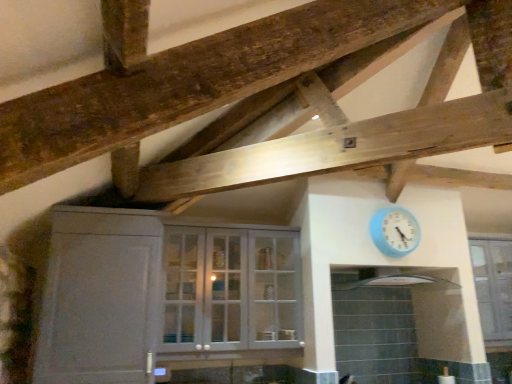
Question: Is light blue plastic wall clock at upper right positioned with its back to white glossy exhaust hood at upper center?

Choices:
 (A) no
 (B) yes

Answer: (A)

Question: Does light blue plastic wall clock at upper right have a lesser width compared to white glossy exhaust hood at upper center?

Choices:
 (A) no
 (B) yes

Answer: (B)

Question: From a real-world perspective, is light blue plastic wall clock at upper right over white glossy exhaust hood at upper center?

Choices:
 (A) yes
 (B) no

Answer: (A)

Question: Does light blue plastic wall clock at upper right have a greater height compared to white glossy exhaust hood at upper center?

Choices:
 (A) no
 (B) yes

Answer: (B)

Question: Is light blue plastic wall clock at upper right to the left of white glossy exhaust hood at upper center from the viewer's perspective?

Choices:
 (A) no
 (B) yes

Answer: (A)

Question: In the image, is white glossy exhaust hood at upper center positioned in front of or behind clear glass cabinet at upper center?

Choices:
 (A) behind
 (B) front

Answer: (B)

Question: Considering the positions of point (334, 288) and point (485, 279), is point (334, 288) closer or farther from the camera than point (485, 279)?

Choices:
 (A) farther
 (B) closer

Answer: (B)

Question: In terms of width, does white glossy exhaust hood at upper center look wider or thinner when compared to clear glass cabinet at upper center?

Choices:
 (A) thin
 (B) wide

Answer: (B)

Question: Visually, is white glossy exhaust hood at upper center positioned to the left or to the right of clear glass cabinet at upper center?

Choices:
 (A) left
 (B) right

Answer: (A)

Question: Considering the positions of light blue plastic wall clock at upper right and white glossy cabinet at center in the image, is light blue plastic wall clock at upper right taller or shorter than white glossy cabinet at center?

Choices:
 (A) short
 (B) tall

Answer: (A)

Question: In the image, is light blue plastic wall clock at upper right positioned in front of or behind white glossy cabinet at center?

Choices:
 (A) front
 (B) behind

Answer: (B)

Question: In the image, is light blue plastic wall clock at upper right on the left side or the right side of white glossy cabinet at center?

Choices:
 (A) right
 (B) left

Answer: (A)

Question: Is light blue plastic wall clock at upper right bigger or smaller than white glossy cabinet at center?

Choices:
 (A) big
 (B) small

Answer: (B)

Question: From a real-world perspective, is white glossy cabinet at center positioned above or below white glossy exhaust hood at upper center?

Choices:
 (A) below
 (B) above

Answer: (A)

Question: Looking at their shapes, would you say white glossy cabinet at center is wider or thinner than white glossy exhaust hood at upper center?

Choices:
 (A) wide
 (B) thin

Answer: (B)